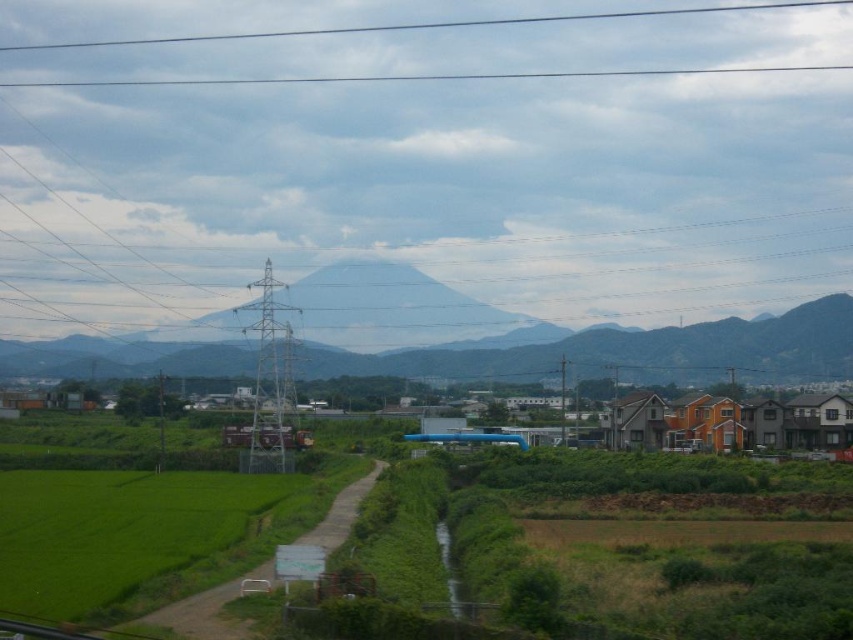
Consider the image. You are standing at the center of the dirt path in the rural landscape. You see the green grass field at lower left and the transparent glass power line at upper center. Which object is positioned to the left of the other?

The green grass field at lower left is to the left of transparent glass power line at upper center.

You are a drone operator planning to fly a drone with a wingspan of 1.2 meters through the gap between the gray rocky mountain at center and the transparent glass power line at upper center. Based on the scene, can the drone safely pass through the gap without touching either object?

The gray rocky mountain at center is larger in size than the transparent glass power line at upper center. However, the exact distance between them isn

You are a surveyor measuring distances in the rural landscape. You need to determine if the distance between the green grass field at lower left and the transparent glass power line at upper center is within the legal safety limit of 500 feet. Is the distance compliant?

The distance between the green grass field at lower left and the transparent glass power line at upper center is 655.17 feet, which exceeds the legal safety limit of 500 feet. Therefore, it is not compliant.